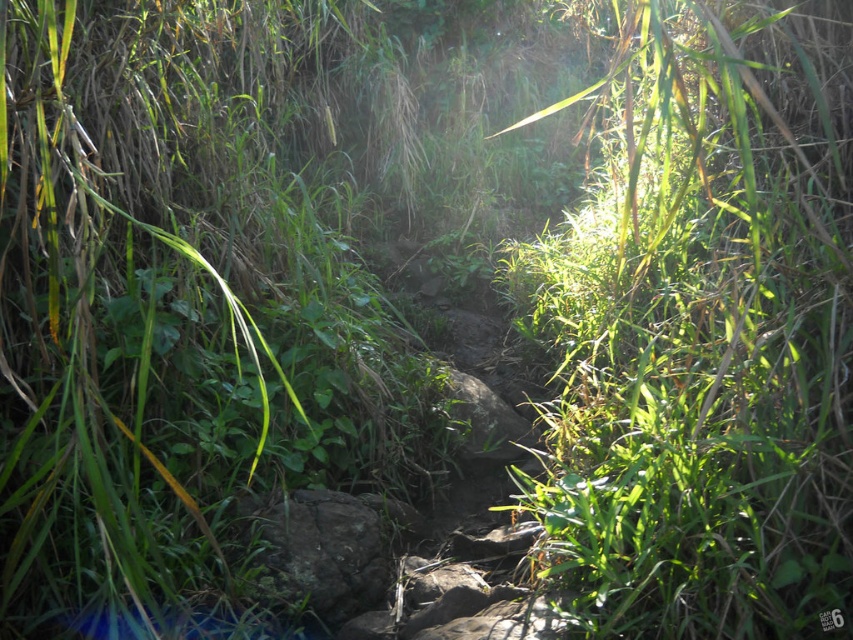
You are a hiker trying to walk along the narrow, rocky path. You notice the green leafy grass at center and the gray rough rock at center. Which object is covering the other one?

The green leafy grass at center is positioned over gray rough rock at center, so the grass is covering the rock.

You are a hiker trying to walk along the narrow rocky path. You notice the green leafy grass at center and the gray rough rock at center. Which of these two objects is taller?

The green leafy grass at center is taller than the gray rough rock at center.

You are a hiker walking along the path and want to step on the gray rough rock at center. Can you see the green leafy grass at center between your current position and the rock?

Yes, the green leafy grass at center is in front of the gray rough rock at center, so you can see it between your current position and the rock.